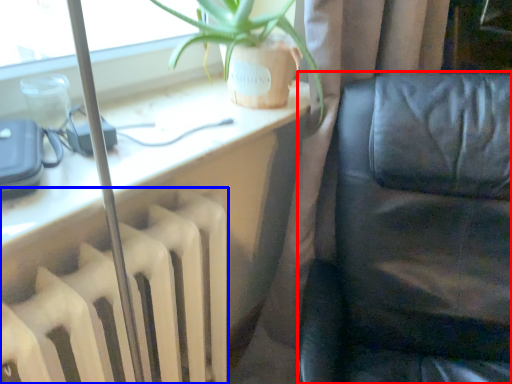
Question: Which of the following is the closest to the observer, furniture (highlighted by a red box) or radiator (highlighted by a blue box)?

Choices:
 (A) furniture
 (B) radiator

Answer: (A)